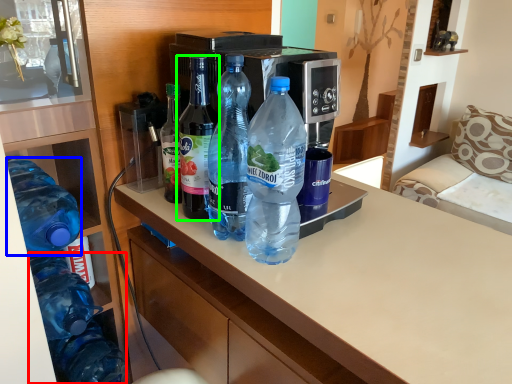
Question: Which object is the closest to the bottle (highlighted by a red box)? Choose among these: bottle (highlighted by a blue box) or bottle (highlighted by a green box).

Choices:
 (A) bottle
 (B) bottle

Answer: (A)